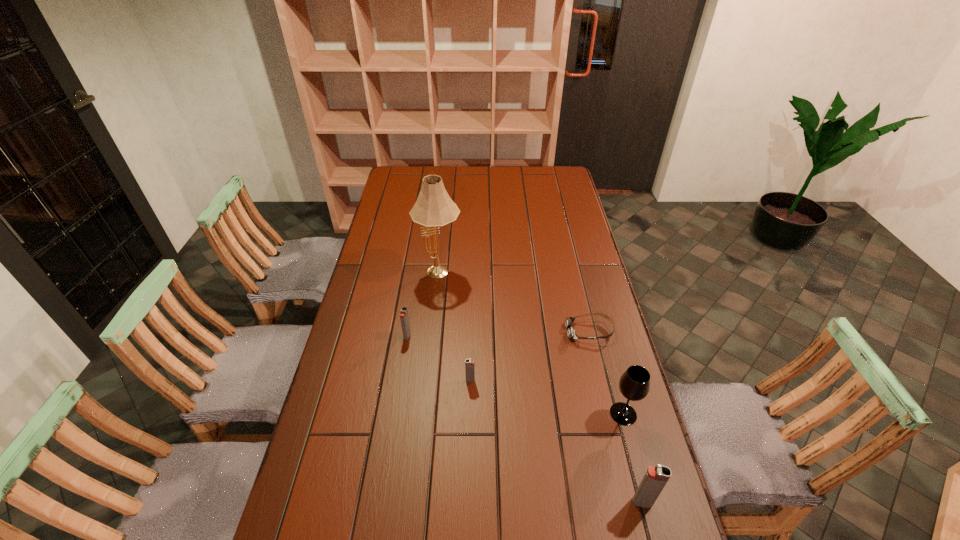
Locate an element on the screen. The width and height of the screenshot is (960, 540). goggles located in the right edge section of the desktop is located at coordinates (571, 333).

Identify the location of wineglass that is at the right edge. Image resolution: width=960 pixels, height=540 pixels. (634, 384).

This screenshot has height=540, width=960. In order to click on object positioned at the near right corner in this screenshot , I will do `click(655, 478)`.

Locate an element on the screen. free space at the far edge is located at coordinates (514, 171).

In the image, there is a desktop. Identify the location of vacant space at the left edge. (348, 450).

Locate an element on the screen. The width and height of the screenshot is (960, 540). free space at the right edge of the desktop is located at coordinates (581, 218).

Find the location of a particular element. This screenshot has width=960, height=540. free location at the far left corner of the desktop is located at coordinates (420, 186).

Identify the location of free space at the far right corner. This screenshot has height=540, width=960. (545, 183).

The width and height of the screenshot is (960, 540). I want to click on vacant region between the nearest object and the fourth farthest object, so click(556, 441).

Locate an element on the screen. free space between the tallest object and the shortest object is located at coordinates (515, 303).